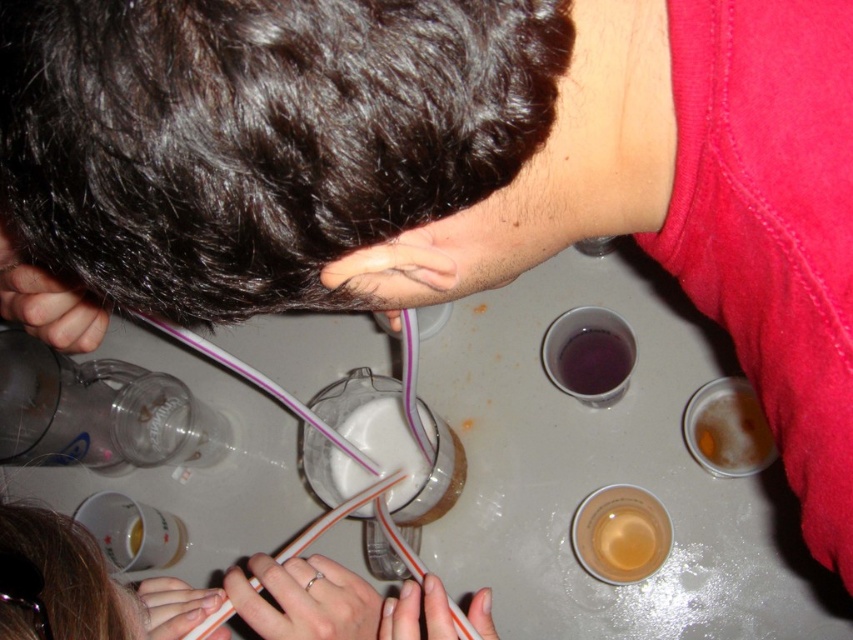
Question: Which object is the farthest from the translucent plastic cup at upper center?

Choices:
 (A) white matte straws at center
 (B) translucent plastic cup at lower center
 (C) silver metallic ring at lower center
 (D) white translucent shot glass at center

Answer: (C)

Question: Is white plastic straw at lower center to the left of white translucent shot glass at center from the viewer's perspective?

Choices:
 (A) no
 (B) yes

Answer: (B)

Question: Is foamy golden beer at lower right below white matte straws at center?

Choices:
 (A) no
 (B) yes

Answer: (A)

Question: Which point is closer to the camera?

Choices:
 (A) white matte straws at lower left
 (B) matte black hair at upper left
 (C) translucent plastic cup at lower center

Answer: (A)

Question: Does translucent plastic cup at upper center have a lesser width compared to foamy golden beer at lower right?

Choices:
 (A) no
 (B) yes

Answer: (B)

Question: Which of the following is the closest to the observer?

Choices:
 (A) (585, 314)
 (B) (613, 515)

Answer: (A)